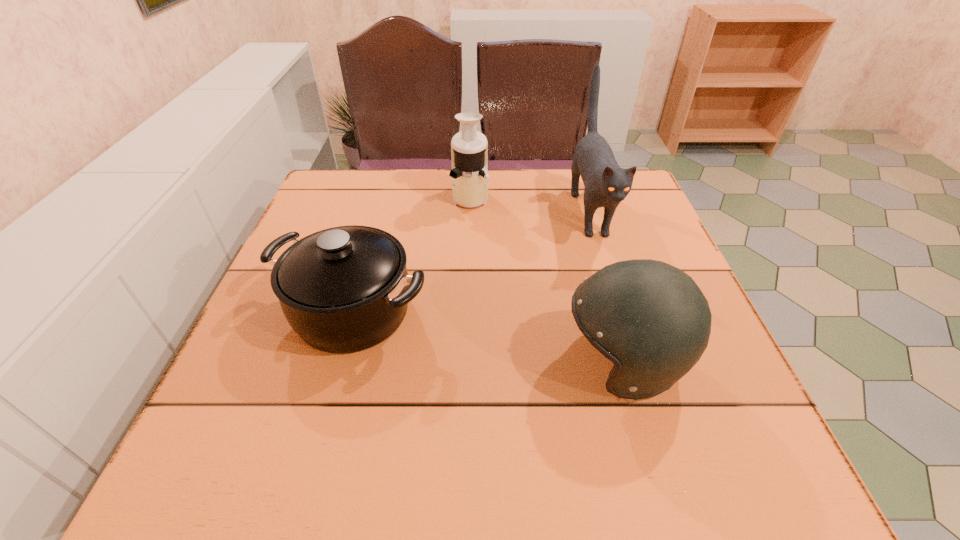
The image size is (960, 540). Find the location of `vacant space located on the back of the saucepan`. vacant space located on the back of the saucepan is located at coordinates (374, 235).

This screenshot has height=540, width=960. What are the coordinates of `cat at the far edge` in the screenshot? It's located at (606, 184).

Where is `juicer that is at the far edge`? This screenshot has height=540, width=960. juicer that is at the far edge is located at coordinates (469, 148).

Where is `object present at the left edge`? Image resolution: width=960 pixels, height=540 pixels. object present at the left edge is located at coordinates (345, 289).

Locate an element on the screen. The height and width of the screenshot is (540, 960). cat present at the right edge is located at coordinates (606, 184).

This screenshot has width=960, height=540. What are the coordinates of `football helmet at the right edge` in the screenshot? It's located at coord(651,319).

I want to click on object that is at the far right corner, so click(606, 184).

The width and height of the screenshot is (960, 540). In the image, there is a desktop. In order to click on vacant space at the far edge in this screenshot , I will do `click(544, 207)`.

In the image, there is a desktop. Where is `vacant space at the near edge`? The height and width of the screenshot is (540, 960). vacant space at the near edge is located at coordinates 419,492.

Where is `free space at the left edge of the desktop`? This screenshot has width=960, height=540. free space at the left edge of the desktop is located at coordinates (275, 323).